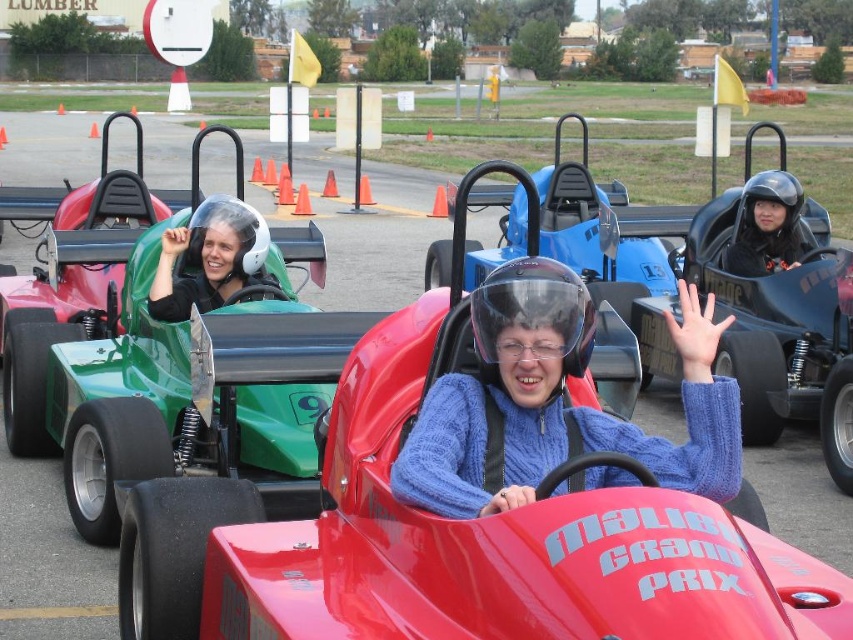
Question: Based on their relative distances, which object is nearer to the black helmet at center?

Choices:
 (A) blue knitted sweater at center
 (B) matte black helmet at upper center

Answer: (B)

Question: Based on their relative distances, which object is nearer to the black helmet at center?

Choices:
 (A) blue knitted sweater at center
 (B) matte black helmet at upper center

Answer: (B)

Question: Which object appears closest to the camera in this image?

Choices:
 (A) matte black helmet at upper center
 (B) blue knitted sweater at center

Answer: (B)

Question: Can you confirm if blue knitted sweater at center is bigger than black helmet at center?

Choices:
 (A) no
 (B) yes

Answer: (B)

Question: Is blue knitted sweater at center positioned before black helmet at center?

Choices:
 (A) no
 (B) yes

Answer: (B)

Question: Can you confirm if blue knitted sweater at center is positioned above black helmet at center?

Choices:
 (A) yes
 (B) no

Answer: (B)